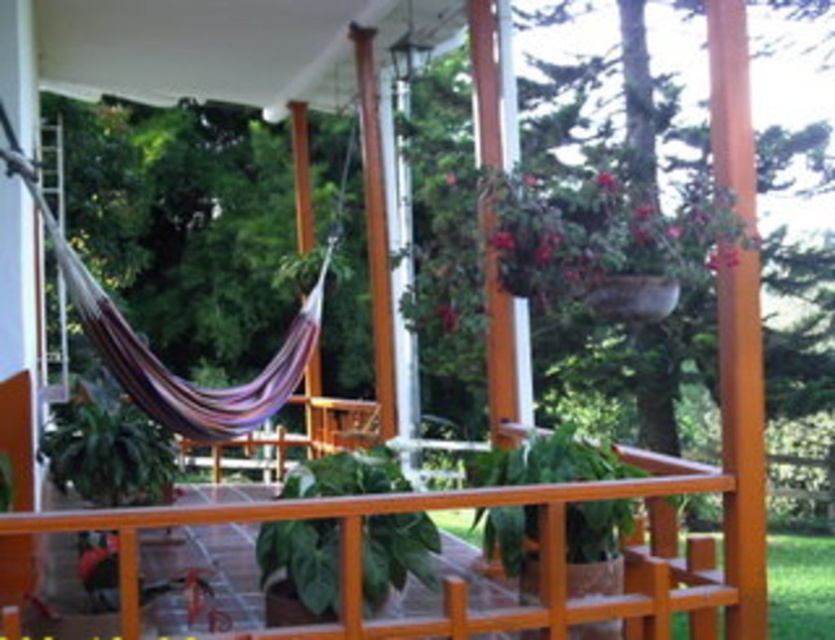
Question: Which point is farther to the camera?

Choices:
 (A) (372, 592)
 (B) (466, 472)
 (C) (139, 429)

Answer: (C)

Question: Where is green matte leafy plant at center located in relation to green leafy plant at center in the image?

Choices:
 (A) below
 (B) above

Answer: (A)

Question: Based on their relative distances, which object is farther from the green leafy plant at center?

Choices:
 (A) green matte leafy plant at center
 (B) green matte plant at center

Answer: (B)

Question: Considering the relative positions of green matte plant at center and green leafy plant at center in the image provided, where is green matte plant at center located with respect to green leafy plant at center?

Choices:
 (A) left
 (B) right

Answer: (B)

Question: Which object is the farthest from the green leafy plant at center?

Choices:
 (A) green matte plant at center
 (B) green matte leafy plant at center

Answer: (A)

Question: Is green matte plant at center to the left of green leafy plant at center from the viewer's perspective?

Choices:
 (A) yes
 (B) no

Answer: (B)